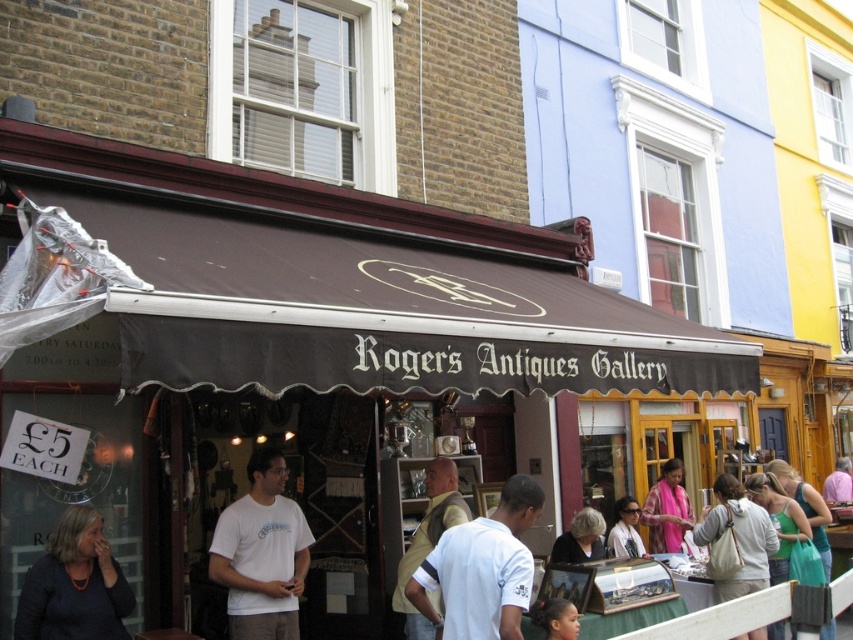
You are a customer entering Rogers Antiques Gallery and notice two items displayed in the center area. The items are a matte white shirt at center and a smooth brown hair at lower center. Which item is taller?

The matte white shirt at center is taller than the smooth brown hair at lower center.

You are standing outside Rogers Antiques Gallery and want to enter the shop. You notice two points marked on the ground near the entrance. The first point is at coordinate point(523, 568) and the second is at point(225, 528). If you walk towards the entrance, which point will you step on first?

Point(523, 568) is in front of point(225, 528), so you will step on point(523, 568) first as you walk towards the entrance.